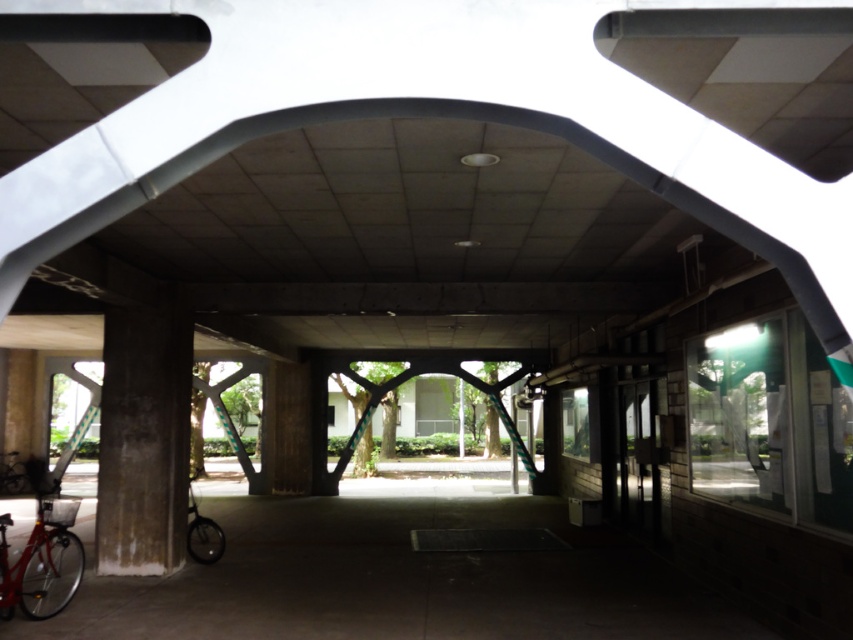
You are standing at the entrance of the covered walkway and see the shiny red bicycle at lower left. There is a point marked at coordinates (42, 563). Where is this point located?

The point at (42, 563) is located on the shiny red bicycle at lower left.